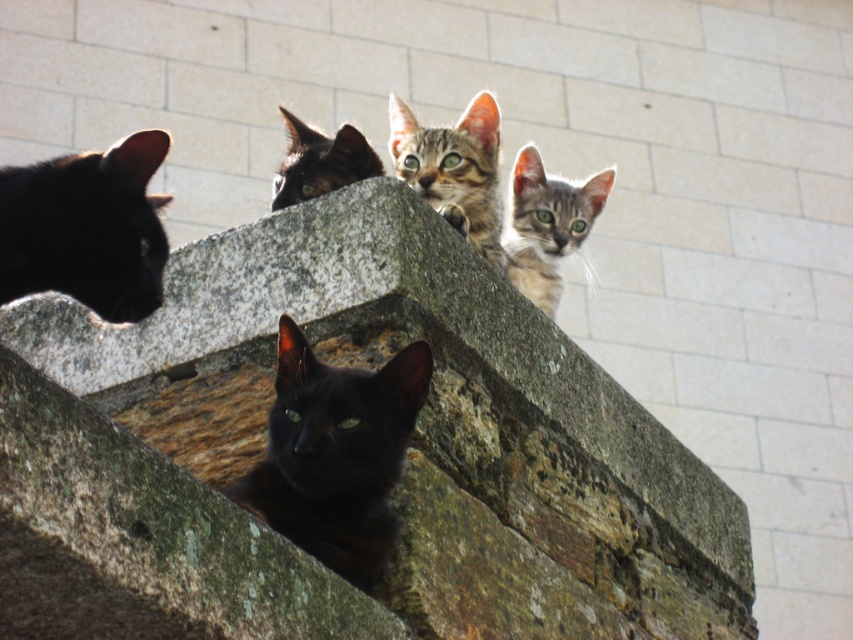
The width and height of the screenshot is (853, 640). Identify the location of black glossy cat at center. 335,452.

Between point (383, 435) and point (549, 259), which one is positioned behind?

The point (549, 259) is behind.

Does point (294, 456) lie behind point (578, 186)?

No, (294, 456) is closer to viewer.

This screenshot has width=853, height=640. I want to click on black glossy cat at center, so click(335, 452).

Is matte black cat at left wider than tabby fur kitten at upper right?

In fact, matte black cat at left might be narrower than tabby fur kitten at upper right.

Does matte black cat at left appear over tabby fur kitten at upper right?

Incorrect, matte black cat at left is not positioned above tabby fur kitten at upper right.

Identify the location of matte black cat at left. The height and width of the screenshot is (640, 853). (86, 228).

Based on the photo, can you confirm if granite ledge at upper center is taller than matte black cat at left?

Yes.

Describe the element at coordinates (399, 481) in the screenshot. Image resolution: width=853 pixels, height=640 pixels. I see `granite ledge at upper center` at that location.

Identify the location of granite ledge at upper center. (399, 481).